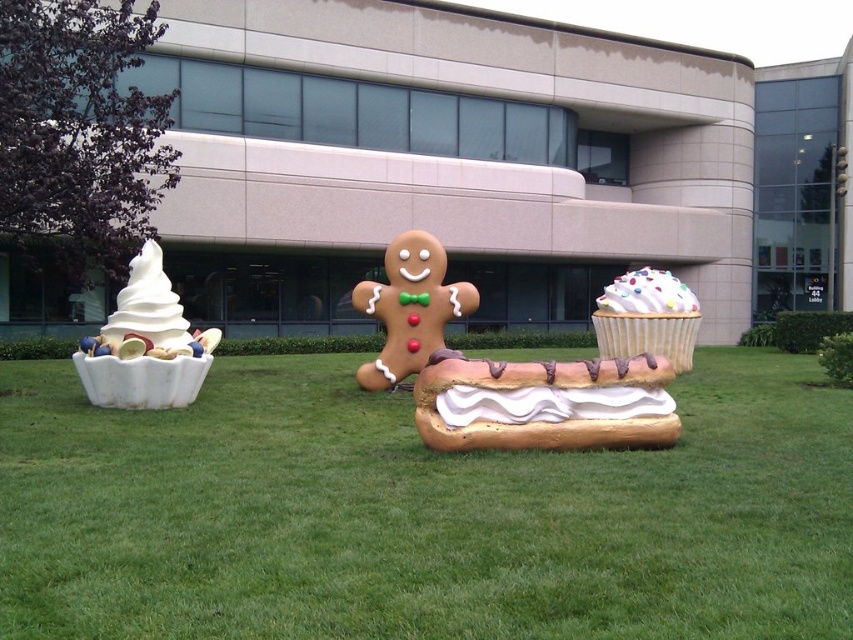
You are organizing a picnic and need to choose between the white matte hot dog at center and the white matte ice cream cone at left. Which one is bigger?

The white matte ice cream cone at left is bigger than the white matte hot dog at center.

You are a photographer planning to take a photo of the white matte ice cream cone at left and the white glossy cupcake at center right. You want to ensure both are visible in the frame. Based on their positions, which object should you place closer to the camera to keep both in focus?

The white glossy cupcake at center right should be placed closer to the camera because it is positioned to the right of the white matte ice cream cone at left, allowing both to be in focus when centered.

You are a visitor standing between the white matte ice cream cone at left and the white glossy cupcake at center right. You want to place a 5 meter long banner between them. Will the banner fit without overlapping either object?

The distance between the white matte ice cream cone at left and the white glossy cupcake at center right is 7.61 meters. Since the banner is 5 meters long, it will fit between them without overlapping either object as there is enough space.